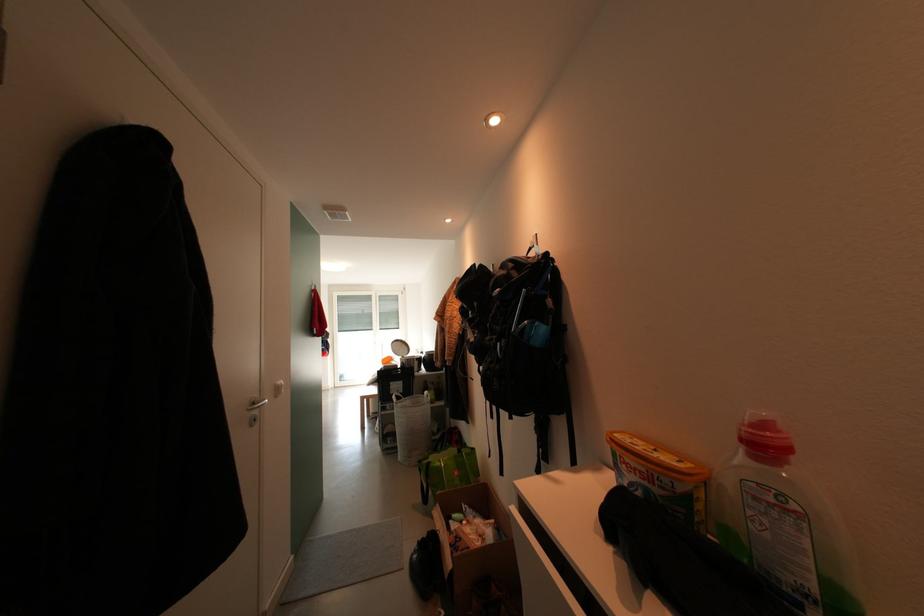
You are a GUI agent. You are given a task and a screenshot of the screen. Output one action in this format:
    pyautogui.click(x=<x>, y=<y>)
    Task: Click on the chair sitting surface
    The image size is (924, 616).
    Given the screenshot: What is the action you would take?
    pyautogui.click(x=368, y=408)